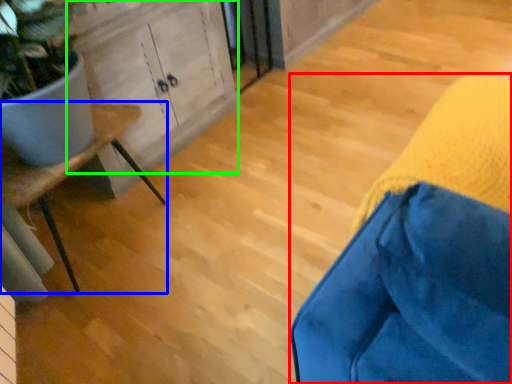
Question: Which is nearer to the furniture (highlighted by a red box)? furniture (highlighted by a blue box) or cabinetry (highlighted by a green box).

Choices:
 (A) furniture
 (B) cabinetry

Answer: (A)